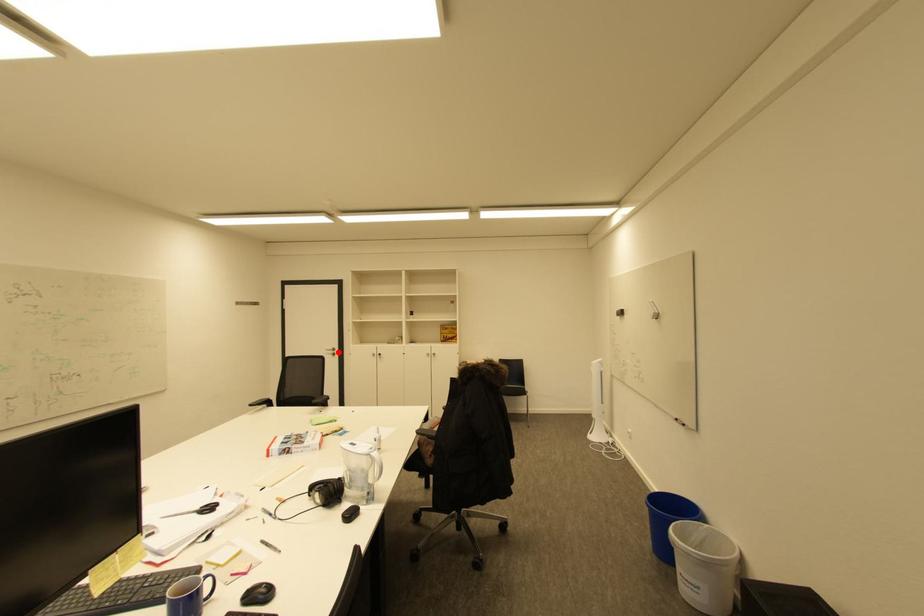
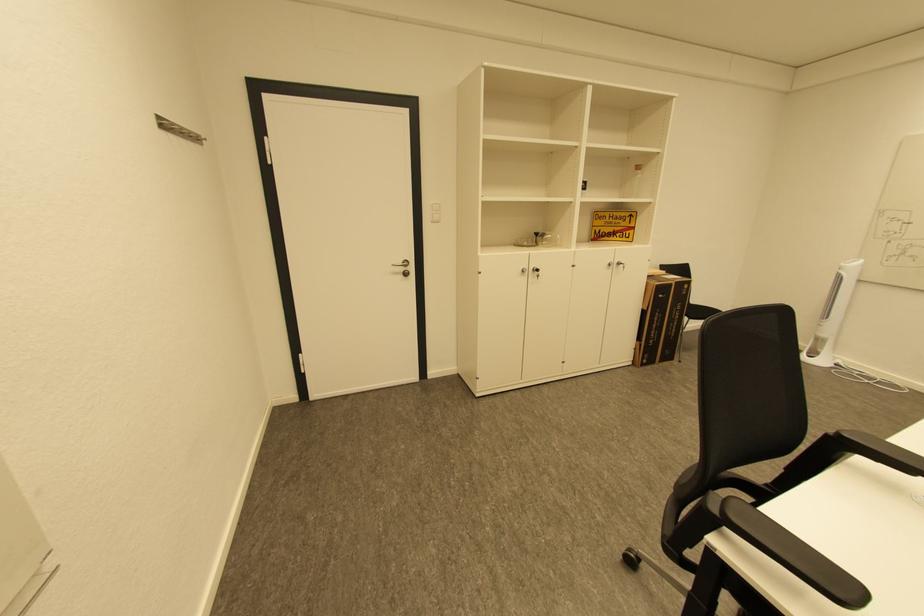
Where in the second image is the point corresponding to the highlighted location from the first image?

(408, 270)